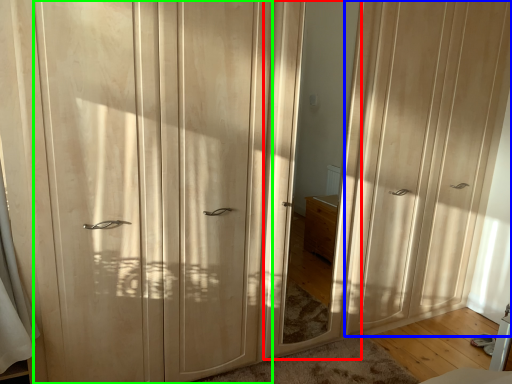
Question: Based on their relative distances, which object is nearer to mirror (highlighted by a red box)? Choose from screen door (highlighted by a blue box) and screen door (highlighted by a green box).

Choices:
 (A) screen door
 (B) screen door

Answer: (A)